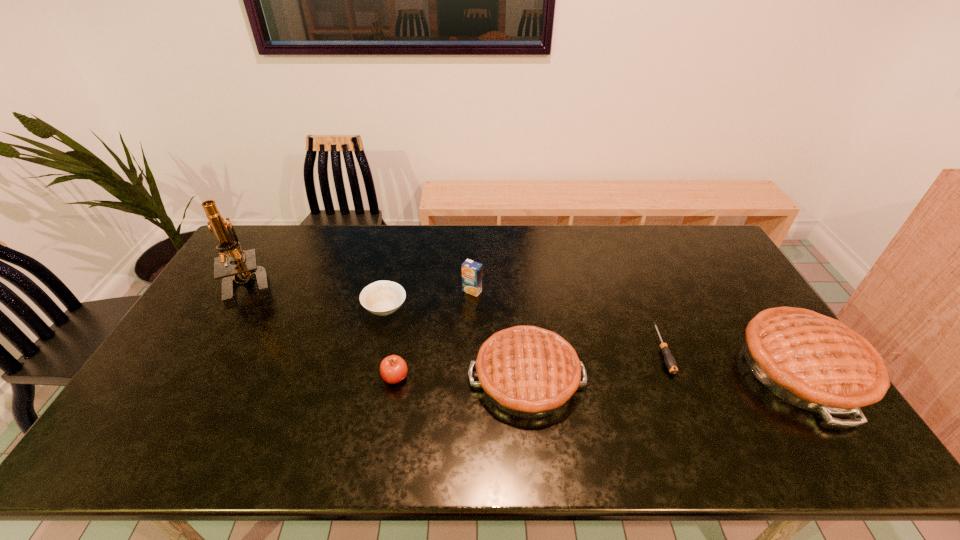
All pies are currently evenly spaced. To continue this pattern, where would you add another pie on the left? Please point out a vacant spot. Please provide its 2D coordinates. Your answer should be formatted as a tuple, i.e. [(x, y)], where the tuple contains the x and y coordinates of a point satisfying the conditions above.

[(240, 388)]